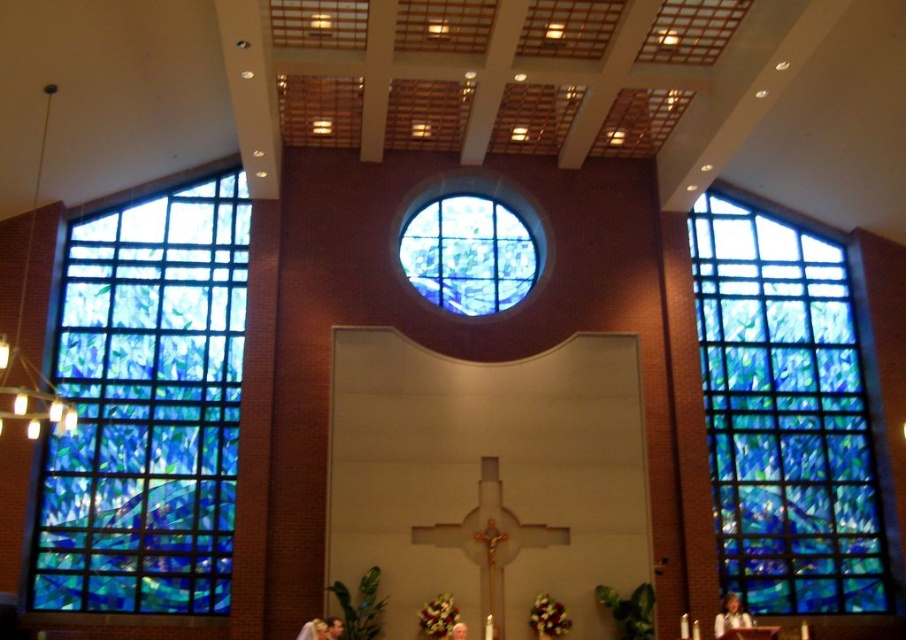
Is point (142, 224) farther from camera compared to point (527, 236)?

No.

Is stained glass window at left positioned before blue stained glass window at center?

Yes, it is in front of blue stained glass window at center.

Is point (174, 364) positioned behind point (446, 211)?

No, (174, 364) is closer to viewer.

Where is `stained glass window at left`? stained glass window at left is located at coordinates (147, 406).

Is point (206, 598) closer to viewer compared to point (808, 513)?

Yes, it is in front of point (808, 513).

Is point (95, 547) more distant than point (739, 461)?

No.

Image resolution: width=906 pixels, height=640 pixels. I want to click on stained glass window at left, so click(x=147, y=406).

Does point (847, 348) come behind point (434, 268)?

That is True.

Is blue stained glass window at right closer to the viewer compared to blue stained glass window at center?

Yes, blue stained glass window at right is in front of blue stained glass window at center.

Is point (805, 576) more distant than point (430, 202)?

No, it is in front of (430, 202).

This screenshot has width=906, height=640. What are the coordinates of `blue stained glass window at right` in the screenshot? It's located at (786, 416).